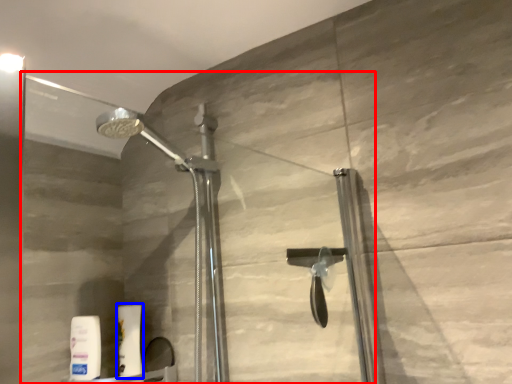
Question: Which point is further to the camera, glass door (highlighted by a red box) or toiletry (highlighted by a blue box)?

Choices:
 (A) glass door
 (B) toiletry

Answer: (B)